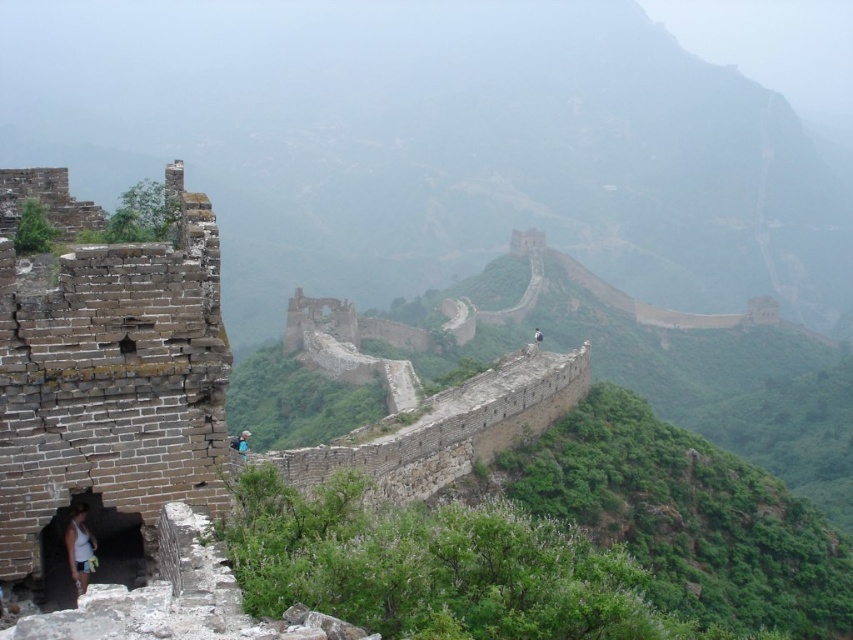
Is dark blue fabric backpack at center thinner than dark blue fabric person at center?

Yes, dark blue fabric backpack at center is thinner than dark blue fabric person at center.

From the picture: Is dark blue fabric backpack at center wider than dark blue fabric person at center?

In fact, dark blue fabric backpack at center might be narrower than dark blue fabric person at center.

Is point (247, 442) positioned in front of point (535, 337)?

That is True.

At what (x,y) coordinates should I click in order to perform the action: click on dark blue fabric backpack at center. Please return your answer as a coordinate pair (x, y). Looking at the image, I should click on (242, 444).

Between point (115, 100) and point (247, 456), which one is positioned behind?

The point (115, 100) is more distant.

Which of these two, foggy stone wall at center or dark blue fabric backpack at center, stands taller?

foggy stone wall at center is taller.

Image resolution: width=853 pixels, height=640 pixels. Identify the location of foggy stone wall at center. (436, 145).

Between point (822, 321) and point (73, 556), which one is positioned in front?

Point (73, 556) is in front.

Is foggy stone wall at center further to the viewer compared to white cotton tank top at lower left?

Yes, foggy stone wall at center is further from the viewer.

The image size is (853, 640). Describe the element at coordinates (436, 145) in the screenshot. I see `foggy stone wall at center` at that location.

Identify the location of foggy stone wall at center. Image resolution: width=853 pixels, height=640 pixels. (436, 145).